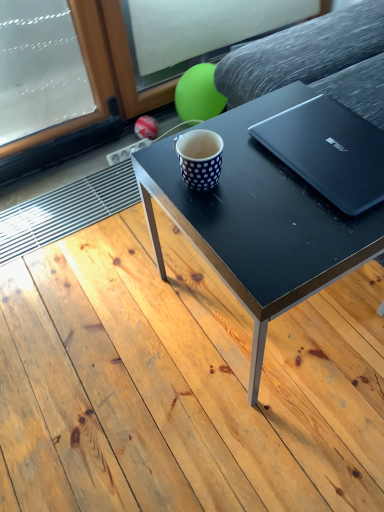
Locate an element on the screen. This screenshot has width=384, height=512. free location to the left of black matte laptop at upper right is located at coordinates (236, 179).